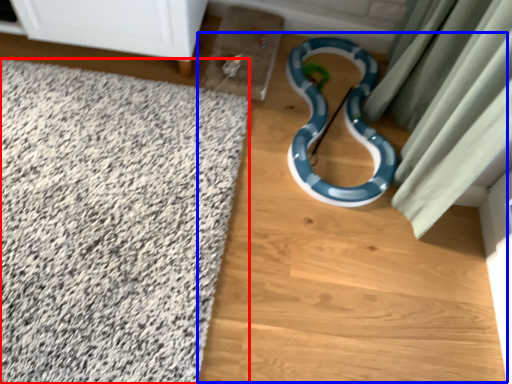
Question: Which object is further to the camera taking this photo, bath mat (highlighted by a red box) or dirt track (highlighted by a blue box)?

Choices:
 (A) bath mat
 (B) dirt track

Answer: (B)